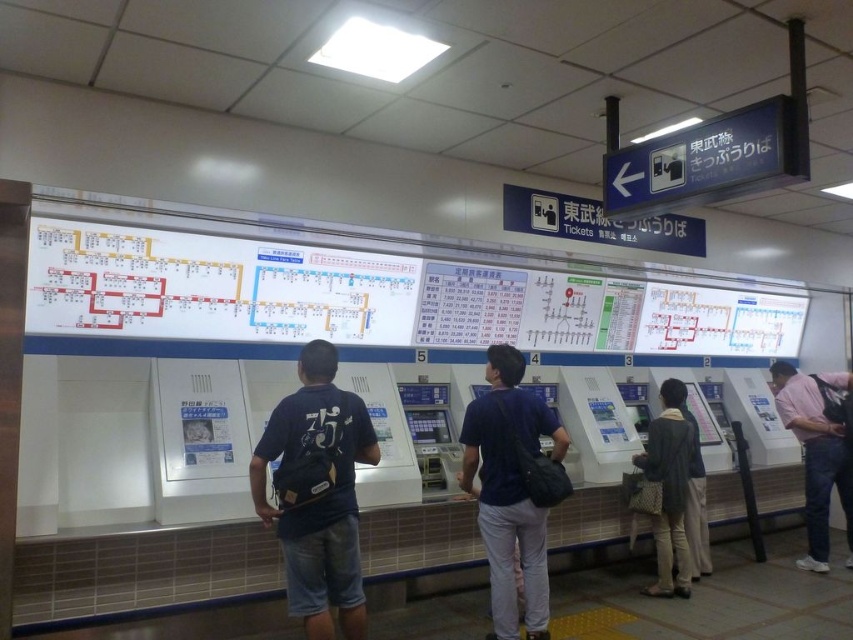
You are standing in the ticketing area of the train station and see a dark blue shirt at center and a pink cotton shirt at right. Which person is taller?

The dark blue shirt at center is much taller than the pink cotton shirt at right.

You are standing in the train station and see the dark blue backpack at center and the dark blue shirt at center. Which one is closer to you?

The dark blue backpack at center is closer to you because it is in front of the dark blue shirt at center.

You are a traveler standing in the ticketing area and you want to retrieve your dark blue backpack at center. However, there is a pink cotton shirt at right in your way. Can you reach your backpack without moving the shirt?

The dark blue backpack at center is positioned over the pink cotton shirt at right, meaning the backpack is above the shirt. Since the backpack is above the shirt, you can reach it without needing to move the shirt.